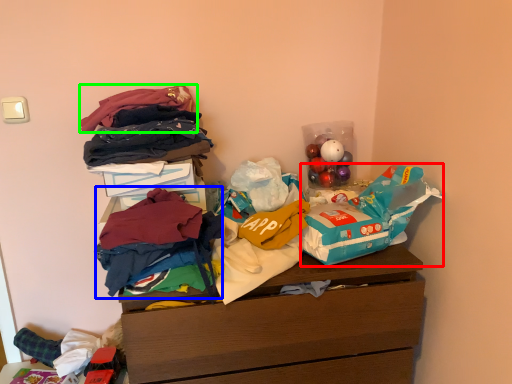
Question: Estimate the real-world distances between objects in this image. Which object is closer to grocery bag (highlighted by a red box), clothing (highlighted by a blue box) or clothing (highlighted by a green box)?

Choices:
 (A) clothing
 (B) clothing

Answer: (A)